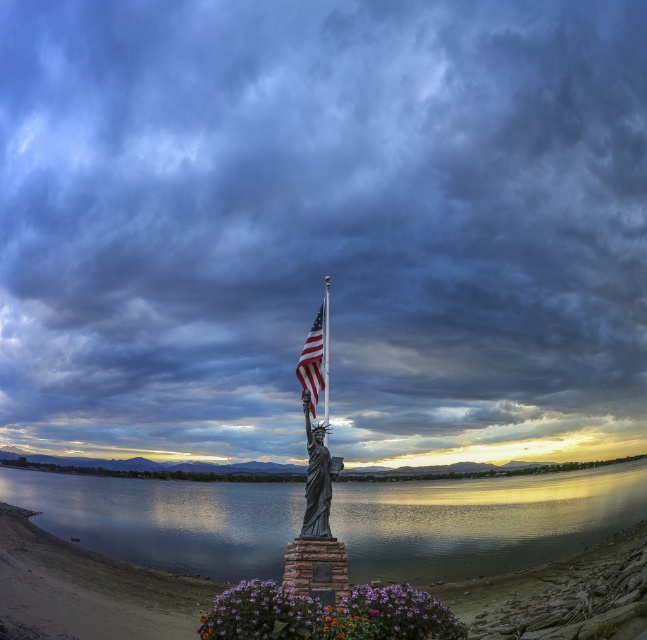
This screenshot has height=640, width=647. Describe the element at coordinates (479, 522) in the screenshot. I see `glossy water at statue center` at that location.

Between point (107, 506) and point (316, 356), which one is positioned in front?

Point (316, 356) is more forward.

This screenshot has width=647, height=640. I want to click on glossy water at statue center, so (479, 522).

How far apart are bronze statue of liberty at center and american flag at center?

bronze statue of liberty at center is 17.49 meters away from american flag at center.

Who is taller, bronze statue of liberty at center or american flag at center?

bronze statue of liberty at center

Find the location of `bronze statue of liberty at center`. bronze statue of liberty at center is located at coordinates (316, 477).

Looking at this image, is glossy water at statue center smaller than bronze statue of liberty at center?

Incorrect, glossy water at statue center is not smaller in size than bronze statue of liberty at center.

I want to click on glossy water at statue center, so click(x=479, y=522).